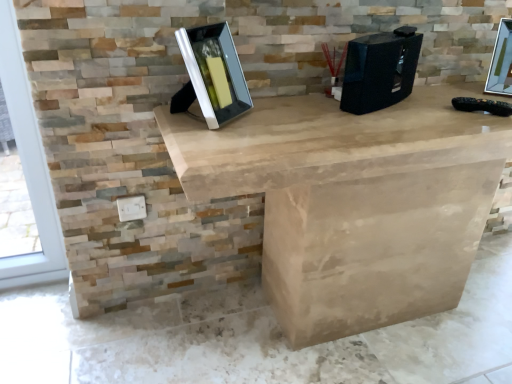
The height and width of the screenshot is (384, 512). I want to click on vacant location below matte black picture frame at center, which is the first picture frame from front to back (from a real-world perspective), so click(207, 320).